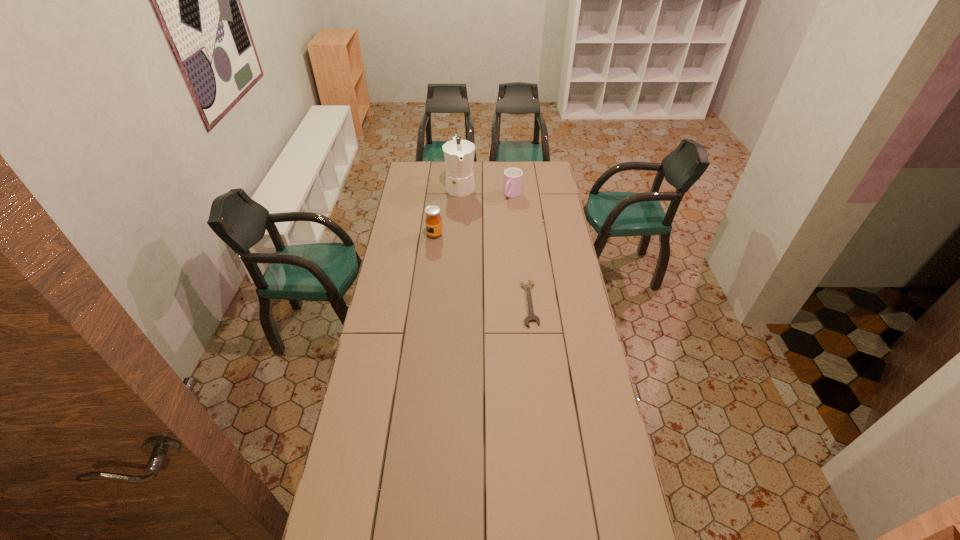
Where is `free space on the desktop that is between the honey and the wrench and is positioned at the spout of the coffeepot`? This screenshot has width=960, height=540. free space on the desktop that is between the honey and the wrench and is positioned at the spout of the coffeepot is located at coordinates (476, 265).

Locate an element on the screen. The image size is (960, 540). free space on the desktop that is between the honey and the nearest object and is positioned with the handle on the side of the cup is located at coordinates (466, 257).